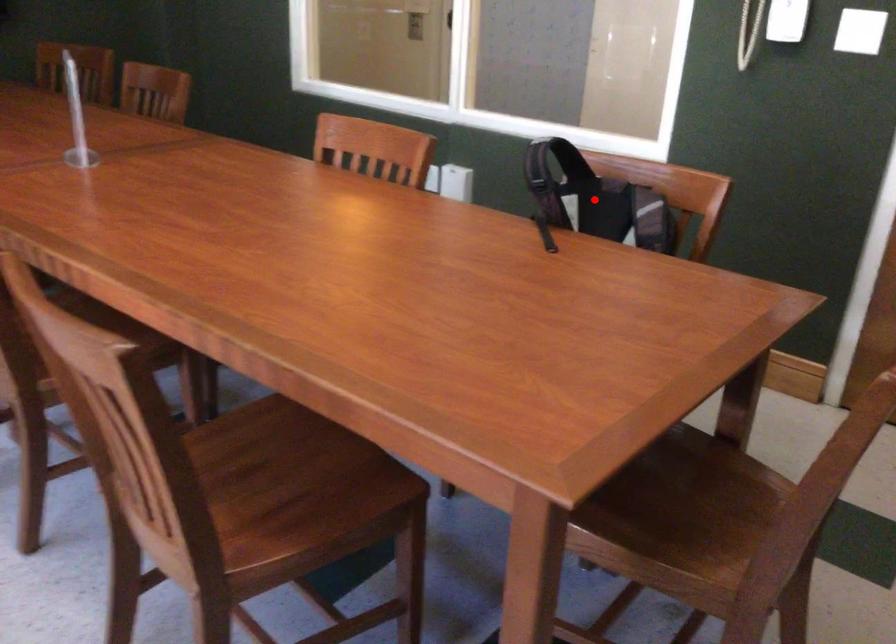
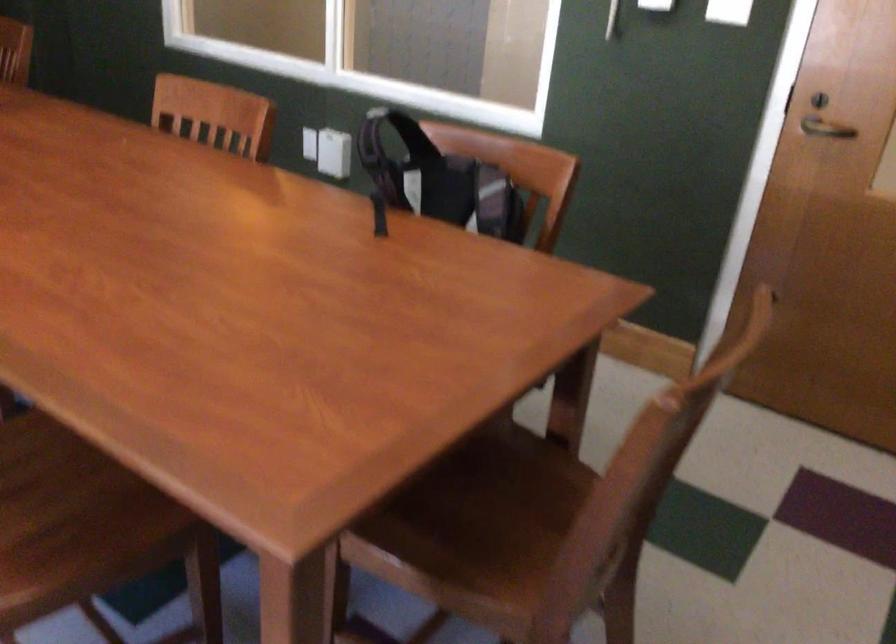
Locate, in the second image, the point that corresponds to the highlighted location in the first image.

(438, 180)